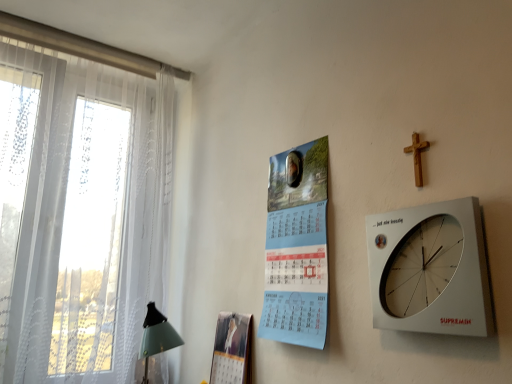
Question: Is wooden cross at upper right wider than white plastic wall clock at upper right?

Choices:
 (A) yes
 (B) no

Answer: (B)

Question: Is wooden cross at upper right next to white plastic wall clock at upper right?

Choices:
 (A) yes
 (B) no

Answer: (B)

Question: Can you confirm if wooden cross at upper right is bigger than white plastic wall clock at upper right?

Choices:
 (A) no
 (B) yes

Answer: (A)

Question: Can white plastic wall clock at upper right be found inside wooden cross at upper right?

Choices:
 (A) yes
 (B) no

Answer: (B)

Question: Is wooden cross at upper right positioned in front of white plastic wall clock at upper right?

Choices:
 (A) yes
 (B) no

Answer: (B)

Question: Do you think white sheer curtain at left is within white plastic wall clock at upper right, or outside of it?

Choices:
 (A) outside
 (B) inside

Answer: (A)

Question: Is point (14, 180) closer or farther from the camera than point (437, 316)?

Choices:
 (A) farther
 (B) closer

Answer: (A)

Question: Considering the positions of white sheer curtain at left and white plastic wall clock at upper right in the image, is white sheer curtain at left bigger or smaller than white plastic wall clock at upper right?

Choices:
 (A) small
 (B) big

Answer: (B)

Question: Considering their positions, is white sheer curtain at left located in front of or behind white plastic wall clock at upper right?

Choices:
 (A) front
 (B) behind

Answer: (B)

Question: In terms of width, does white sheer curtain at left look wider or thinner when compared to wooden cross at upper right?

Choices:
 (A) thin
 (B) wide

Answer: (B)

Question: In terms of size, does white sheer curtain at left appear bigger or smaller than wooden cross at upper right?

Choices:
 (A) big
 (B) small

Answer: (A)

Question: Based on their positions, is white sheer curtain at left located to the left or right of wooden cross at upper right?

Choices:
 (A) left
 (B) right

Answer: (A)

Question: Is point (116, 130) positioned closer to the camera than point (417, 145)?

Choices:
 (A) closer
 (B) farther

Answer: (B)

Question: In terms of height, does wooden cross at upper right look taller or shorter compared to matte paper magazine at center?

Choices:
 (A) short
 (B) tall

Answer: (A)

Question: Based on their sizes in the image, would you say wooden cross at upper right is bigger or smaller than matte paper magazine at center?

Choices:
 (A) big
 (B) small

Answer: (B)